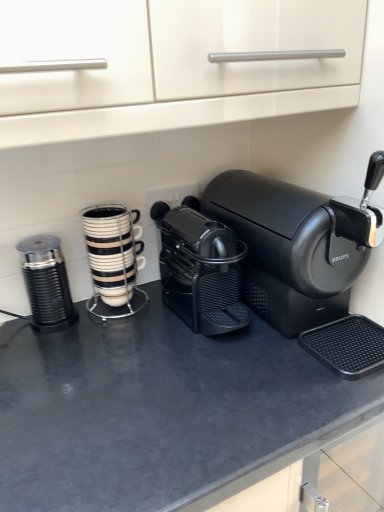
Question: In the image, is metallic ribbed grinder at left, which is the first kitchen appliance from left to right, positioned in front of or behind black matte coffee maker at center, the first coffee maker positioned from the left?

Choices:
 (A) behind
 (B) front

Answer: (A)

Question: Is metallic ribbed grinder at left, marked as the second kitchen appliance in a right-to-left arrangement, wider or thinner than black matte coffee maker at center, the second coffee maker from the right?

Choices:
 (A) thin
 (B) wide

Answer: (A)

Question: Based on their relative distances, which object is farther from the black matte coffee maker at center, the first coffee maker positioned from the left?

Choices:
 (A) black matte coffee maker at center, which is the 1th coffee maker from right to left
 (B) black matte counter top at center
 (C) white glossy cup stack at center, the first kitchen appliance positioned from the right
 (D) metallic ribbed grinder at left, which is the first kitchen appliance from left to right

Answer: (D)

Question: Based on their relative distances, which object is nearer to the metallic ribbed grinder at left, marked as the second kitchen appliance in a right-to-left arrangement?

Choices:
 (A) black matte coffee maker at center, the second coffee maker from the right
 (B) black matte coffee maker at center, which is the 2th coffee maker in left-to-right order
 (C) black matte counter top at center
 (D) white glossy cup stack at center, which is the second kitchen appliance in left-to-right order

Answer: (D)